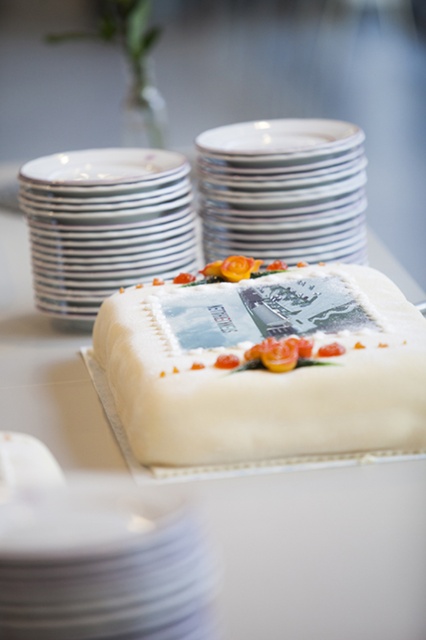
Can you confirm if white ceramic plates at upper left is taller than white glossy stack at upper center?

Yes.

Is point (108, 150) positioned behind point (298, 259)?

Yes, point (108, 150) is farther from viewer.

Image resolution: width=426 pixels, height=640 pixels. Identify the location of white ceramic plates at upper left. (104, 224).

Does white ceramic platter at center have a greater height compared to white ceramic plates at upper left?

Incorrect, white ceramic platter at center's height is not larger of white ceramic plates at upper left's.

Is white ceramic platter at center to the right of white ceramic plates at upper left from the viewer's perspective?

Yes, white ceramic platter at center is to the right of white ceramic plates at upper left.

Between point (8, 595) and point (34, 188), which one is positioned in front?

Point (8, 595) is in front.

Identify the location of white ceramic platter at center. Image resolution: width=426 pixels, height=640 pixels. (103, 564).

Does white smooth cake at center have a lesser width compared to white glossy stack at upper center?

No, white smooth cake at center is not thinner than white glossy stack at upper center.

Where is `white smooth cake at center`? white smooth cake at center is located at coordinates (319, 552).